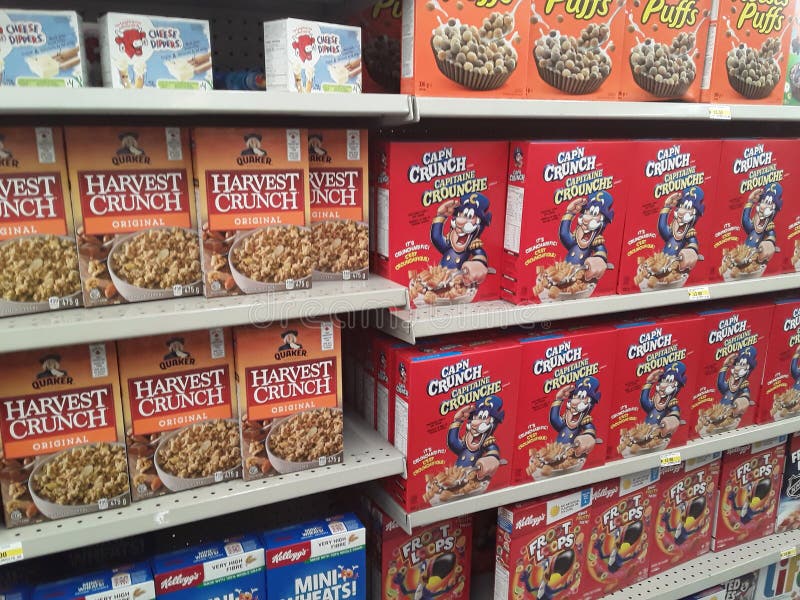
This screenshot has width=800, height=600. Identify the location of shelf. (308, 106), (460, 108), (432, 318), (350, 298), (354, 466), (432, 511), (688, 586).